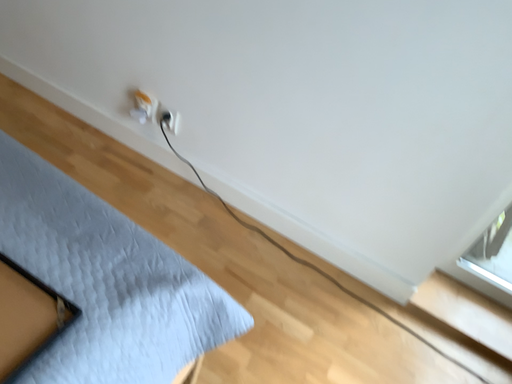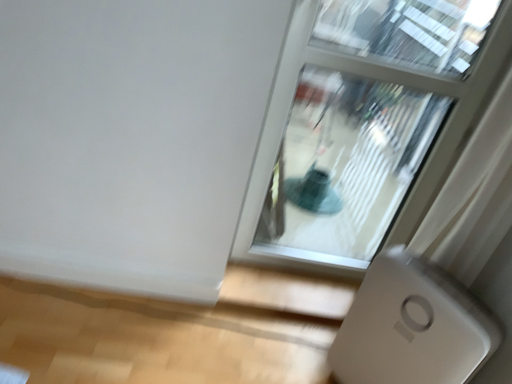
Question: How did the camera likely rotate when shooting the video?

Choices:
 (A) rotated right
 (B) rotated left

Answer: (A)